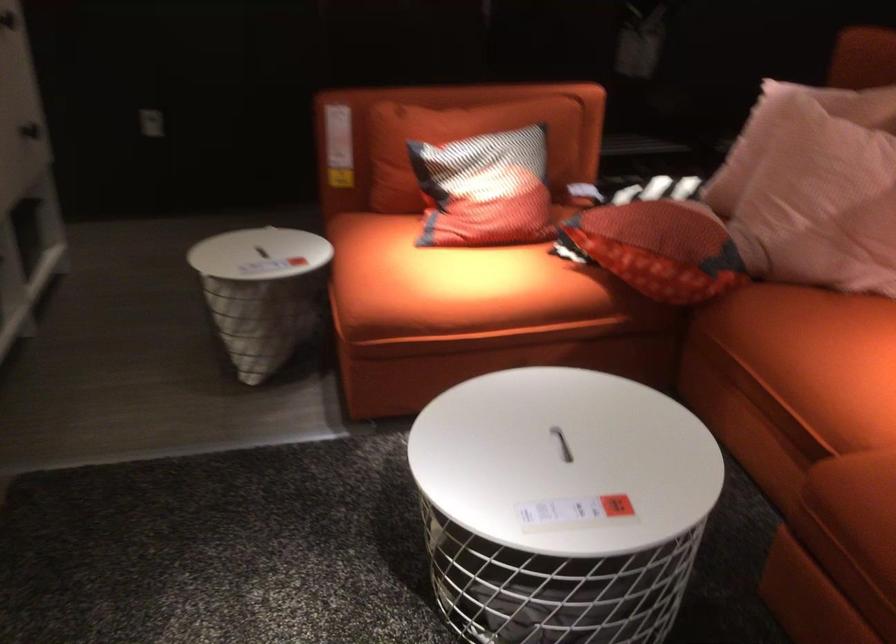
Find the location of a particular element. The width and height of the screenshot is (896, 644). orange sofa sitting surface is located at coordinates (449, 281).